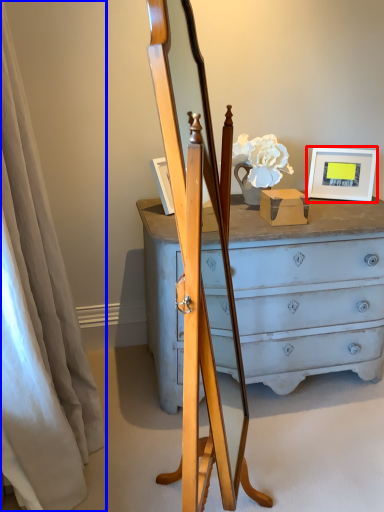
Question: Which object is further to the camera taking this photo, picture frame (highlighted by a red box) or curtain (highlighted by a blue box)?

Choices:
 (A) picture frame
 (B) curtain

Answer: (A)